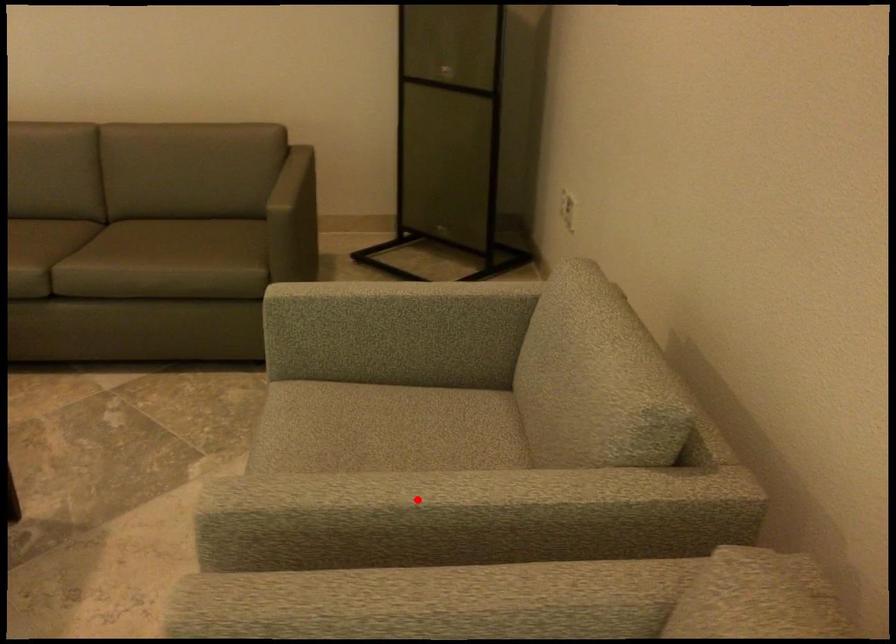
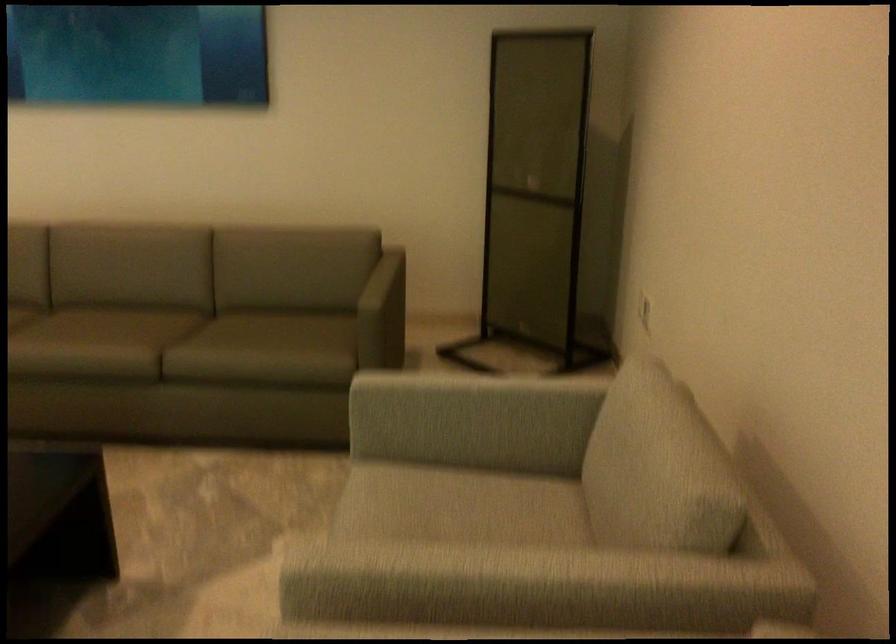
Locate, in the second image, the point that corresponds to the highlighted location in the first image.

(479, 573)